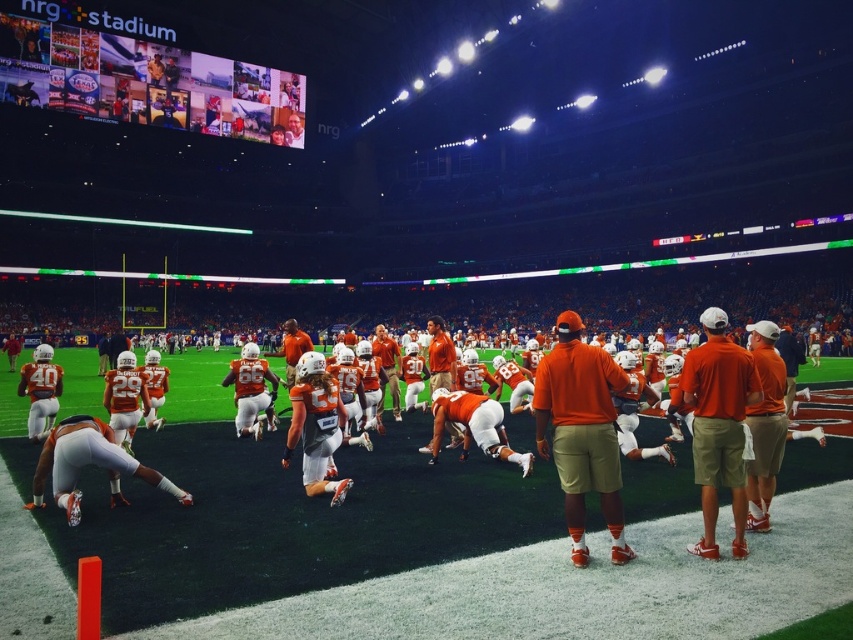
Question: Can you confirm if orange matte uniform at center is positioned above orange cotton shirt at center?

Choices:
 (A) yes
 (B) no

Answer: (B)

Question: Is the position of orange matte uniform at center less distant than that of orange fabric shirt at center?

Choices:
 (A) no
 (B) yes

Answer: (A)

Question: Which object appears closest to the camera in this image?

Choices:
 (A) orange fabric shirt at center
 (B) orange matte uniform at center

Answer: (A)

Question: Is orange matte uniform at center to the left of orange cotton shirt at center from the viewer's perspective?

Choices:
 (A) no
 (B) yes

Answer: (B)

Question: Which point is farther from the camera taking this photo?

Choices:
 (A) (451, 452)
 (B) (563, 384)

Answer: (A)

Question: Which object is farther from the camera taking this photo?

Choices:
 (A) orange fabric shirt at center
 (B) orange cotton shirt at center
 (C) orange matte uniform at center

Answer: (C)